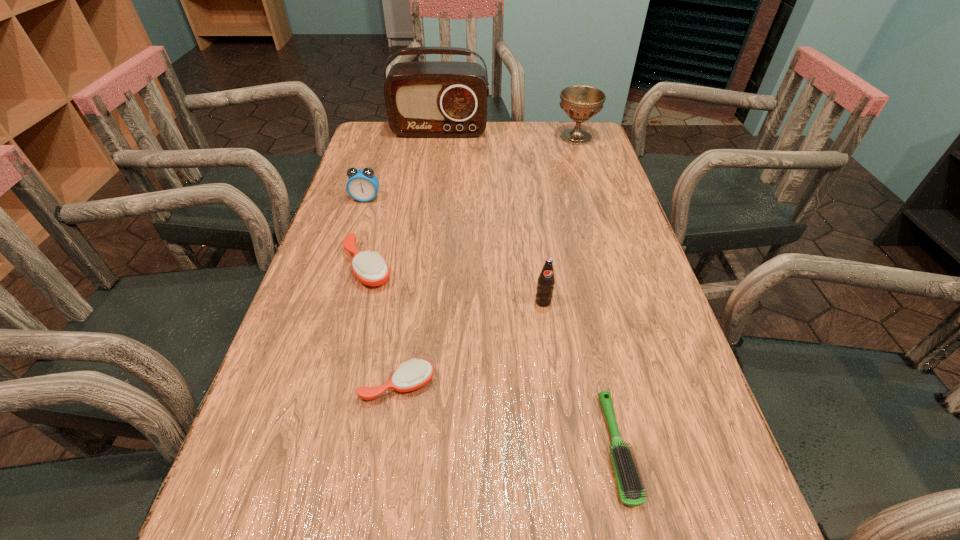
Where is `the second object from right to left`? Image resolution: width=960 pixels, height=540 pixels. the second object from right to left is located at coordinates (629, 485).

Where is `the rightmost hairbrush`? The image size is (960, 540). the rightmost hairbrush is located at coordinates (629, 485).

Where is `vacant area situated 0.080m on the front panel of the tallest object`? The image size is (960, 540). vacant area situated 0.080m on the front panel of the tallest object is located at coordinates (437, 151).

The height and width of the screenshot is (540, 960). What are the coordinates of `vacant region located 0.160m on the front of the rightmost object` in the screenshot? It's located at (588, 175).

Where is `free location located on the front label of the fifth farthest object`? free location located on the front label of the fifth farthest object is located at coordinates (567, 477).

I want to click on free region located 0.390m on the face of the fifth nearest object, so click(x=329, y=316).

The height and width of the screenshot is (540, 960). Identify the location of free spot located 0.210m on the right of the farthest hairbrush. (488, 266).

At what (x,y) coordinates should I click in order to perform the action: click on free space located 0.060m on the front of the nearer orange hairbrush. Please return your answer as a coordinate pair (x, y). Looking at the image, I should click on (390, 438).

Locate an element on the screen. The width and height of the screenshot is (960, 540). vacant space located 0.100m on the right of the shortest hairbrush is located at coordinates (693, 448).

You are a GUI agent. You are given a task and a screenshot of the screen. Output one action in this format:
    pyautogui.click(x=<x>, y=<y>)
    Task: Click on the radio receiver that is at the far edge
    This screenshot has height=540, width=960.
    Given the screenshot: What is the action you would take?
    pyautogui.click(x=427, y=99)